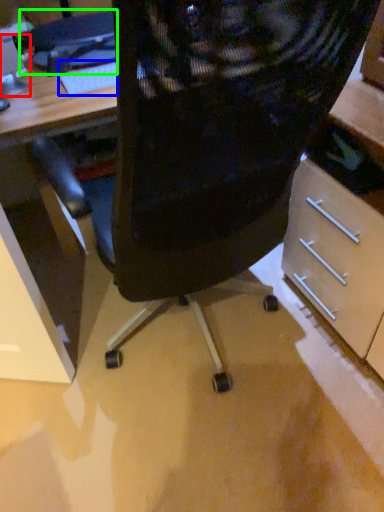
Question: Estimate the real-world distances between objects in this image. Which object is farther from computer monitor (highlighted by a red box), keyboard (highlighted by a blue box) or computer (highlighted by a green box)?

Choices:
 (A) keyboard
 (B) computer

Answer: (A)